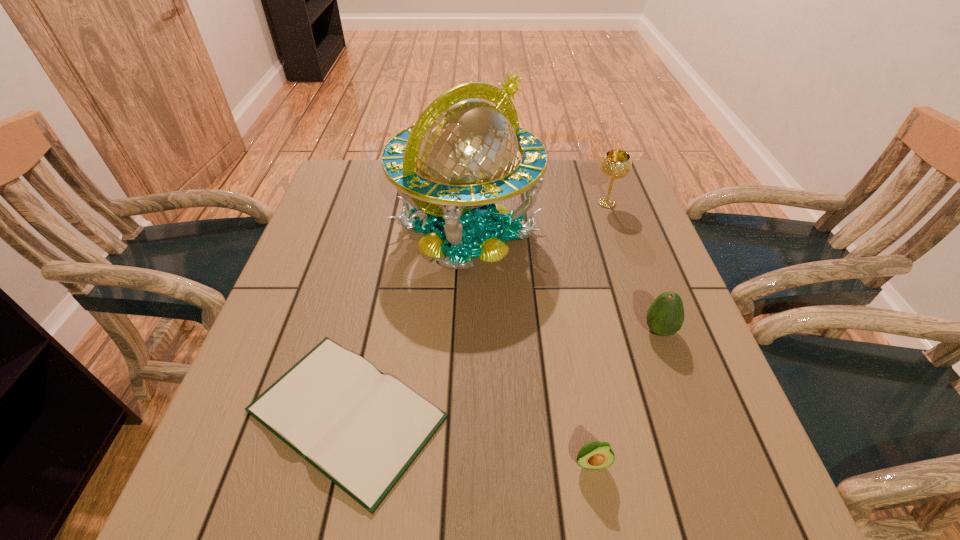
Where is `free region located 0.050m on the cut side of the left avocado`? free region located 0.050m on the cut side of the left avocado is located at coordinates 599,508.

You are a GUI agent. You are given a task and a screenshot of the screen. Output one action in this format:
    pyautogui.click(x=<x>, y=<y>)
    Task: Click on the free region located on the back of the shortest object
    This screenshot has width=960, height=540.
    Given the screenshot: What is the action you would take?
    [x=388, y=233]

Where is `globe situated at the far edge`? Image resolution: width=960 pixels, height=540 pixels. globe situated at the far edge is located at coordinates (461, 155).

Where is `chalice located at the far edge`? The width and height of the screenshot is (960, 540). chalice located at the far edge is located at coordinates (615, 164).

Locate an element on the screen. avocado positioned at the near edge is located at coordinates (593, 455).

Identify the location of hardback book situated at the near edge. The image size is (960, 540). (362, 429).

Locate an element on the screen. The height and width of the screenshot is (540, 960). object located at the left edge is located at coordinates (362, 429).

Image resolution: width=960 pixels, height=540 pixels. Identify the location of chalice positioned at the right edge. (615, 164).

I want to click on avocado located at the right edge, so click(665, 316).

Identify the location of object present at the near left corner. (362, 429).